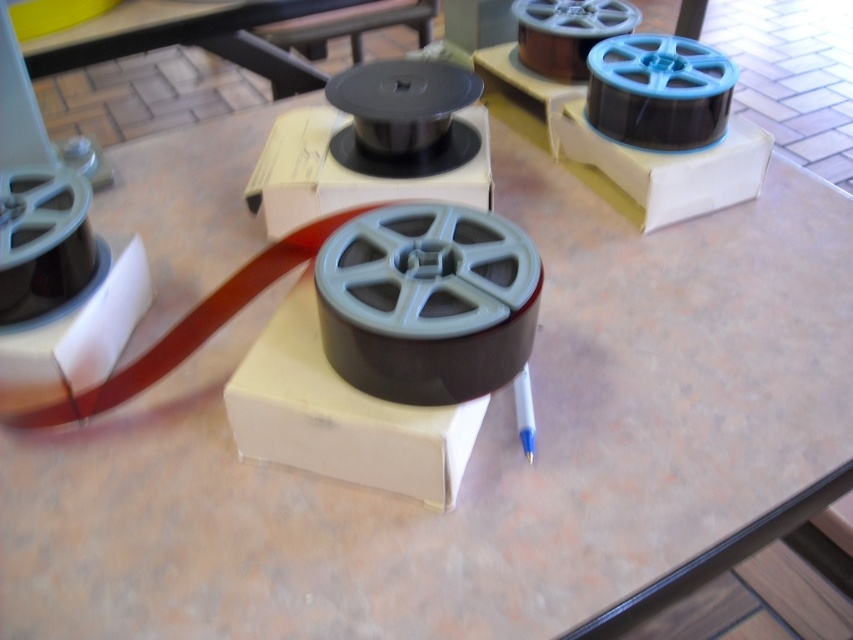
Question: Among these points, which one is nearest to the camera?

Choices:
 (A) (595, 84)
 (B) (556, 65)

Answer: (A)

Question: Can you confirm if matte black spool at center is positioned above matte black film reel at upper center?

Choices:
 (A) yes
 (B) no

Answer: (B)

Question: Does matte black spool at center lie behind matte black film reel at upper center?

Choices:
 (A) yes
 (B) no

Answer: (B)

Question: From the image, what is the correct spatial relationship of gray matte film reel at center in relation to blue plastic spool at upper right?

Choices:
 (A) above
 (B) below

Answer: (B)

Question: Which object is farther from the camera taking this photo?

Choices:
 (A) matte black film reel at upper center
 (B) gray matte film reel at center
 (C) blue plastic spool at upper right

Answer: (A)

Question: Which of the following is the farthest from the observer?

Choices:
 (A) gray matte film reel at center
 (B) matte black spool at center

Answer: (B)